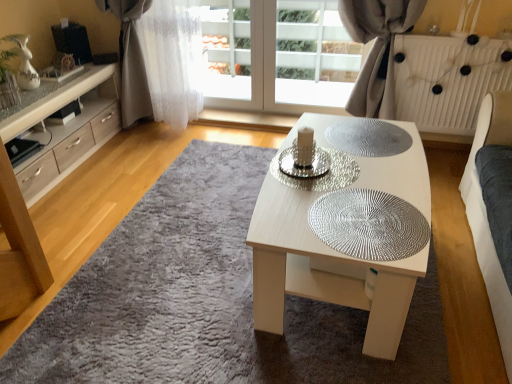
The width and height of the screenshot is (512, 384). I want to click on blank space situated above white textured radiator at upper right (from a real-world perspective), so point(475,34).